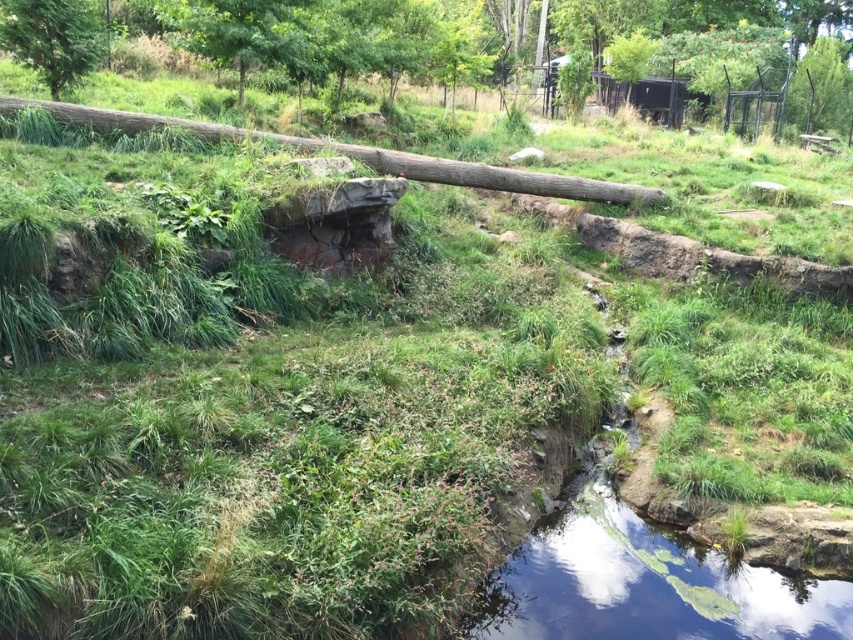
You are standing at the lower left corner of the image. You want to walk towards the green leafy tree at upper center. Which direction should you move in?

The green leafy tree at upper center is located at point (289, 35), so you should move towards the upper center direction to reach it.

From the picture: You are standing at the point labeled as point (x=289, y=35) in the image. Looking towards the stream, which direction should you walk to reach the green leafy tree at upper center?

The point (x=289, y=35) is the location of the green leafy tree at upper center, so you are already at that tree and do not need to walk anywhere else.

You are an observer looking at the scene. Which tree, the green leafy tree at upper center or the green matte tree at upper left, is positioned higher in the image?

The green leafy tree at upper center is positioned higher in the image than the green matte tree at upper left.